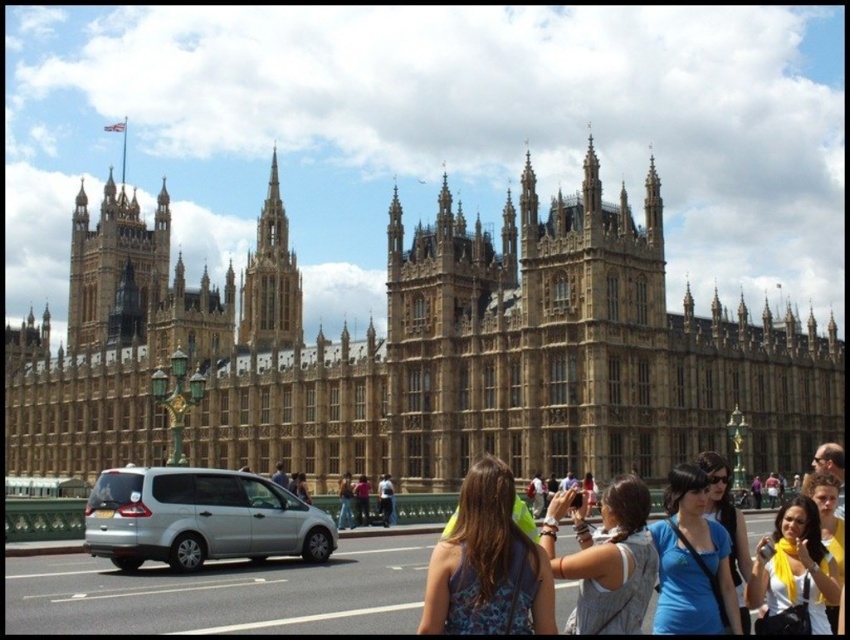
Does yellow scarf at center have a larger size compared to golden stone spire at center?

Incorrect, yellow scarf at center is not larger than golden stone spire at center.

Who is higher up, yellow scarf at center or golden stone spire at center?

golden stone spire at center is higher up.

Which is behind, point (790, 513) or point (287, 280)?

The point (287, 280) is behind.

What are the coordinates of `yellow scarf at center` in the screenshot? It's located at (792, 573).

Where is `neon yellow shirt at center`? The height and width of the screenshot is (640, 850). neon yellow shirt at center is located at coordinates (486, 564).

Which is in front, point (440, 554) or point (797, 532)?

Point (440, 554)

Where is `neon yellow shirt at center`? This screenshot has width=850, height=640. neon yellow shirt at center is located at coordinates (486, 564).

Can you confirm if neon yellow shirt at center is thinner than blue cotton shirt at center?

Correct, neon yellow shirt at center's width is less than blue cotton shirt at center's.

Does neon yellow shirt at center have a lesser height compared to blue cotton shirt at center?

Yes.

Is point (480, 608) closer to camera compared to point (695, 496)?

That is True.

I want to click on neon yellow shirt at center, so click(x=486, y=564).